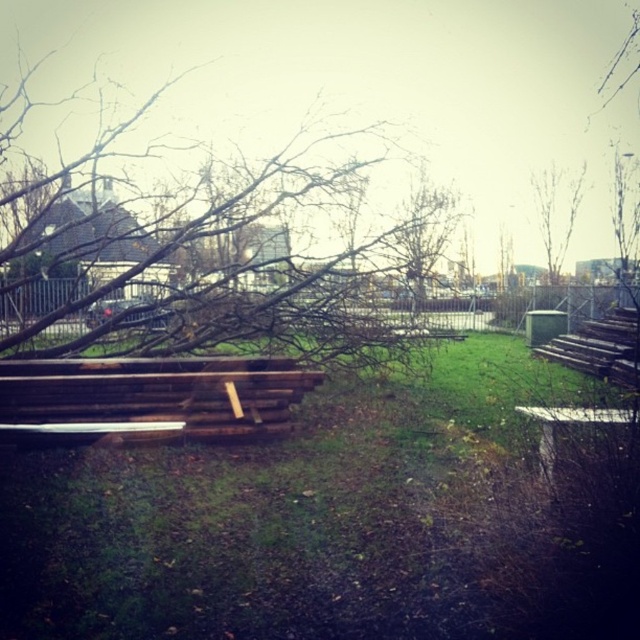
You are standing in the outdoor scene described. You want to place a 3 meter long wooden bench between yourself and the brown wood tree at center. Is there enough space to do so?

The distance between you and the brown wood tree at center is 8.47 meters. Since the bench is 3 meters long, there is sufficient space to place it between yourself and the tree.

You are standing at the point labeled as point (x=225, y=252) in the image. What object are you facing?

The point labeled as point (x=225, y=252) indicates the brown wood tree at center, so you are facing the brown wood tree at center.

In the scene shown: You are sitting on the brown wooden bench at center and want to look up at the bare branches at upper right. In which direction should you tilt your head?

You should tilt your head upward because the brown wooden bench at center is located below the bare branches at upper right.